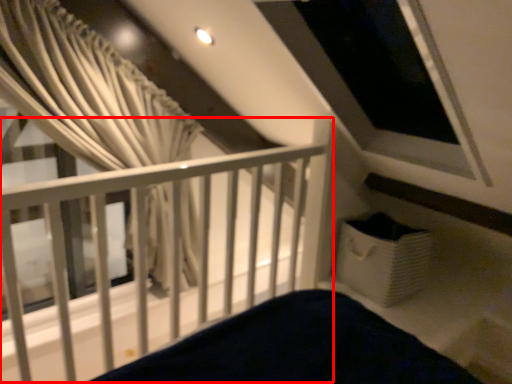
Question: Considering the relative positions of rail (annotated by the red box) and curtain in the image provided, where is rail (annotated by the red box) located with respect to the staircase?

Choices:
 (A) left
 (B) right

Answer: (B)